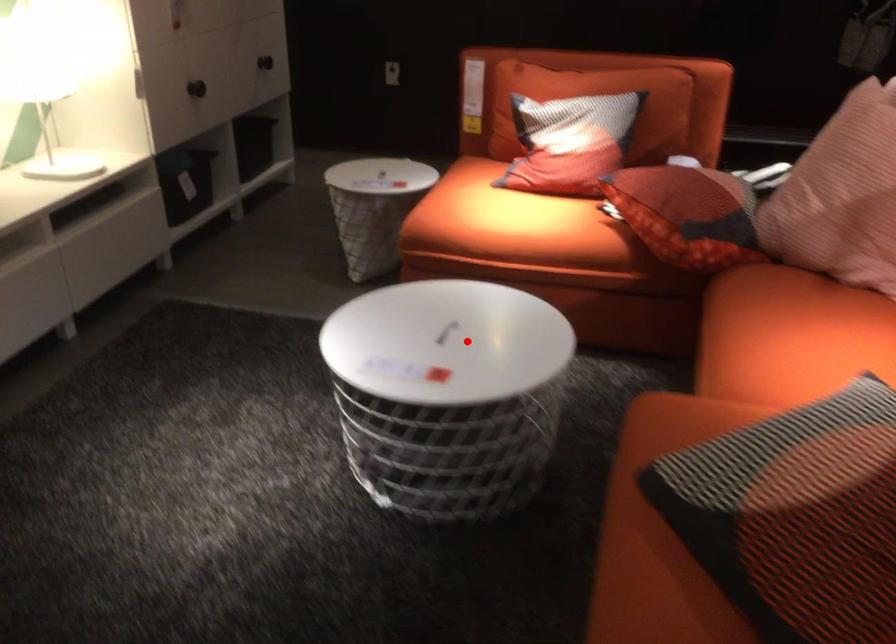
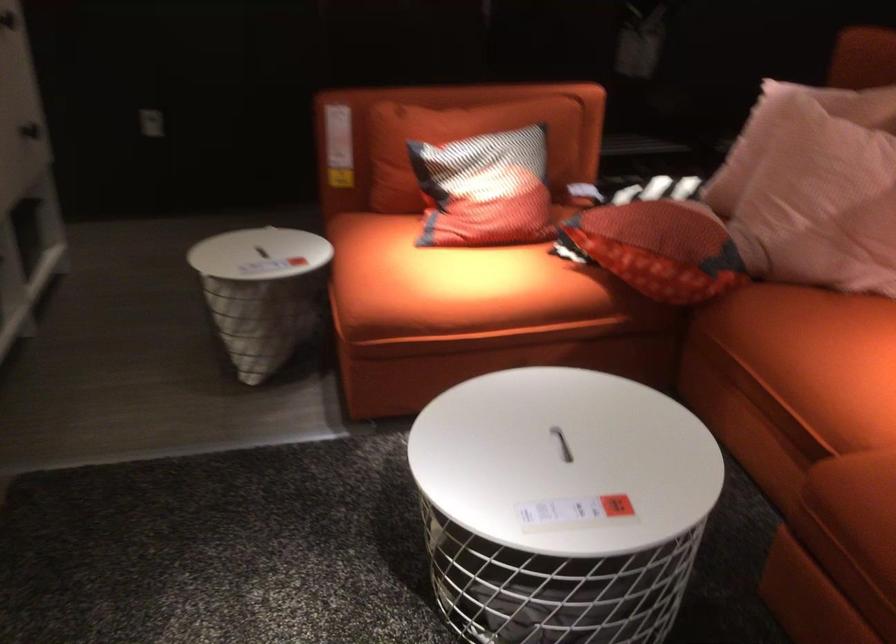
Question: I am providing you with two images of the same scene from different viewpoints. A red point is shown in image1. For the corresponding object point in image2, is it positioned nearer or farther from the camera?

Choices:
 (A) Nearer
 (B) Farther

Answer: (A)